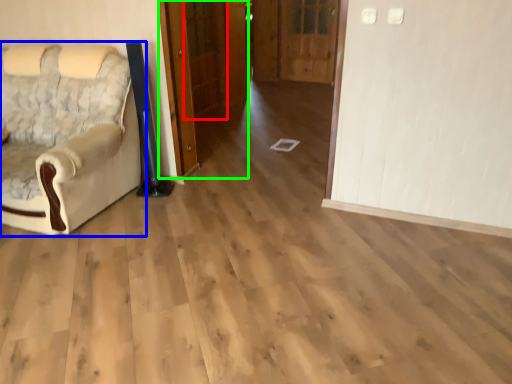
Question: Based on their relative distances, which object is nearer to door (highlighted by a red box)? Choose from chair (highlighted by a blue box) and door (highlighted by a green box).

Choices:
 (A) chair
 (B) door

Answer: (B)